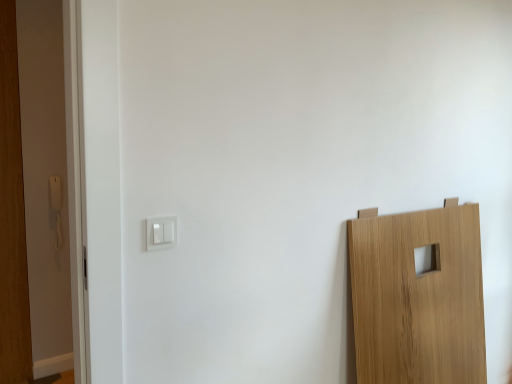
The image size is (512, 384). What do you see at coordinates (55, 193) in the screenshot?
I see `white plastic light switch at center-left, which is the first light switch in left-to-right order` at bounding box center [55, 193].

Locate an element on the screen. Image resolution: width=512 pixels, height=384 pixels. white plastic light switch at center-left, acting as the 2th light switch starting from the right is located at coordinates (55, 193).

At what (x,y) coordinates should I click in order to perform the action: click on white plastic light switch at upper left, which ranks as the 2th light switch in left-to-right order. Please return your answer as a coordinate pair (x, y). The image size is (512, 384). Looking at the image, I should click on (161, 233).

This screenshot has height=384, width=512. What do you see at coordinates (161, 233) in the screenshot?
I see `white plastic light switch at upper left, which ranks as the 2th light switch in left-to-right order` at bounding box center [161, 233].

At what (x,y) coordinates should I click in order to perform the action: click on white plastic light switch at center-left, marked as the first light switch in a top-to-bottom arrangement. Please return your answer as a coordinate pair (x, y). Looking at the image, I should click on (55, 193).

Can you confirm if white plastic light switch at center-left, which ranks as the 2th light switch in bottom-to-top order, is positioned to the left of white plastic light switch at upper left, the 1th light switch from the right?

Indeed, white plastic light switch at center-left, which ranks as the 2th light switch in bottom-to-top order, is positioned on the left side of white plastic light switch at upper left, the 1th light switch from the right.

Considering their positions, is white plastic light switch at center-left, acting as the 2th light switch starting from the right, located in front of or behind white plastic light switch at upper left, positioned as the first light switch in front-to-back order?

white plastic light switch at center-left, acting as the 2th light switch starting from the right, is behind white plastic light switch at upper left, positioned as the first light switch in front-to-back order.

Does point (53, 192) come behind point (155, 244)?

Yes, point (53, 192) is farther from viewer.

From the image's perspective, is white plastic light switch at center-left, which ranks as the 2th light switch in bottom-to-top order, above white plastic light switch at upper left, which ranks as the 2th light switch in left-to-right order?

Yes, from the image's perspective, white plastic light switch at center-left, which ranks as the 2th light switch in bottom-to-top order, is over white plastic light switch at upper left, which ranks as the 2th light switch in left-to-right order.

From a real-world perspective, which object rests below the other?

In real-world perspective, white plastic light switch at center-left, acting as the 2th light switch starting from the right, is lower.

Is white plastic light switch at center-left, acting as the 2th light switch starting from the right, thinner than white plastic light switch at upper left, which is counted as the 2th light switch, starting from the top?

No, white plastic light switch at center-left, acting as the 2th light switch starting from the right, is not thinner than white plastic light switch at upper left, which is counted as the 2th light switch, starting from the top.

In terms of height, does white plastic light switch at center-left, which is the first light switch in left-to-right order, look taller or shorter compared to white plastic light switch at upper left, which ranks as the 2th light switch in left-to-right order?

In the image, white plastic light switch at center-left, which is the first light switch in left-to-right order, appears to be taller than white plastic light switch at upper left, which ranks as the 2th light switch in left-to-right order.

Does white plastic light switch at center-left, marked as the first light switch in a top-to-bottom arrangement, have a larger size compared to white plastic light switch at upper left, the 1th light switch when ordered from bottom to top?

Yes.

Is white plastic light switch at center-left, acting as the 2th light switch starting from the right, positioned beyond the bounds of white plastic light switch at upper left, the 1th light switch from the right?

white plastic light switch at center-left, acting as the 2th light switch starting from the right, is positioned outside white plastic light switch at upper left, the 1th light switch from the right.

Is white plastic light switch at center-left, the 2th light switch when ordered from front to back, far away from white plastic light switch at upper left, positioned as the first light switch in front-to-back order?

white plastic light switch at center-left, the 2th light switch when ordered from front to back, is positioned a significant distance from white plastic light switch at upper left, positioned as the first light switch in front-to-back order.

Is white plastic light switch at center-left, which is the first light switch from back to front, positioned with its back to white plastic light switch at upper left, which is counted as the 2th light switch, starting from the top?

No, white plastic light switch at center-left, which is the first light switch from back to front, is not facing the opposite direction of white plastic light switch at upper left, which is counted as the 2th light switch, starting from the top.

In the scene shown: How different are the orientations of white plastic light switch at center-left, the 2th light switch when ordered from front to back, and white plastic light switch at upper left, the 1th light switch when ordered from bottom to top, in degrees?

0.883 degrees.

This screenshot has width=512, height=384. Identify the location of light switch on the right of white plastic light switch at center-left, which is the first light switch in left-to-right order. (161, 233).

Can you confirm if white plastic light switch at upper left, which ranks as the 2th light switch in back-to-front order, is positioned to the left of white plastic light switch at center-left, which is the first light switch from back to front?

In fact, white plastic light switch at upper left, which ranks as the 2th light switch in back-to-front order, is to the right of white plastic light switch at center-left, which is the first light switch from back to front.

Relative to white plastic light switch at center-left, marked as the first light switch in a top-to-bottom arrangement, is white plastic light switch at upper left, the 1th light switch when ordered from bottom to top, in front or behind?

Clearly, white plastic light switch at upper left, the 1th light switch when ordered from bottom to top, is in front of white plastic light switch at center-left, marked as the first light switch in a top-to-bottom arrangement.

Considering the positions of point (147, 250) and point (58, 197), is point (147, 250) closer or farther from the camera than point (58, 197)?

Point (147, 250) is positioned closer to the camera compared to point (58, 197).

From the image's perspective, is white plastic light switch at upper left, which ranks as the 2th light switch in back-to-front order, below white plastic light switch at center-left, which is the first light switch from back to front?

Yes.

From a real-world perspective, between white plastic light switch at upper left, which ranks as the 2th light switch in left-to-right order, and white plastic light switch at center-left, acting as the 2th light switch starting from the right, who is vertically higher?

white plastic light switch at upper left, which ranks as the 2th light switch in left-to-right order.

Which object is wider, white plastic light switch at upper left, positioned as the first light switch in front-to-back order, or white plastic light switch at center-left, acting as the 2th light switch starting from the right?

white plastic light switch at center-left, acting as the 2th light switch starting from the right.

Who is shorter, white plastic light switch at upper left, positioned as the first light switch in front-to-back order, or white plastic light switch at center-left, which is the first light switch from back to front?

white plastic light switch at upper left, positioned as the first light switch in front-to-back order, is shorter.

Between white plastic light switch at upper left, which ranks as the 2th light switch in left-to-right order, and white plastic light switch at center-left, which is the first light switch in left-to-right order, which one has smaller size?

white plastic light switch at upper left, which ranks as the 2th light switch in left-to-right order, is smaller.

Would you say white plastic light switch at upper left, which ranks as the 2th light switch in back-to-front order, contains white plastic light switch at center-left, acting as the 2th light switch starting from the right?

No, white plastic light switch at center-left, acting as the 2th light switch starting from the right, is not inside white plastic light switch at upper left, which ranks as the 2th light switch in back-to-front order.

Is white plastic light switch at upper left, the 1th light switch from the right, far from white plastic light switch at center-left, which ranks as the 2th light switch in bottom-to-top order?

That's right, there is a large distance between white plastic light switch at upper left, the 1th light switch from the right, and white plastic light switch at center-left, which ranks as the 2th light switch in bottom-to-top order.

Is white plastic light switch at upper left, the 1th light switch from the right, aimed at white plastic light switch at center-left, which is the first light switch from back to front?

No, white plastic light switch at upper left, the 1th light switch from the right, is not facing towards white plastic light switch at center-left, which is the first light switch from back to front.

How different are the orientations of white plastic light switch at upper left, which ranks as the 2th light switch in left-to-right order, and white plastic light switch at center-left, which is the first light switch from back to front, in degrees?

They differ by 0.883 degrees in their facing directions.

Find the location of a particular element. This screenshot has width=512, height=384. light switch lying on the left of white plastic light switch at upper left, the 1th light switch when ordered from bottom to top is located at coordinates (55, 193).

Where is `light switch above the white plastic light switch at center-left, which is the first light switch from back to front (from a real-world perspective)`? Image resolution: width=512 pixels, height=384 pixels. light switch above the white plastic light switch at center-left, which is the first light switch from back to front (from a real-world perspective) is located at coordinates (161, 233).

In the image, there is a white plastic light switch at upper left, the 1th light switch from the right. At what (x,y) coordinates should I click in order to perform the action: click on light switch below it (from a real-world perspective). Please return your answer as a coordinate pair (x, y). Looking at the image, I should click on (55, 193).